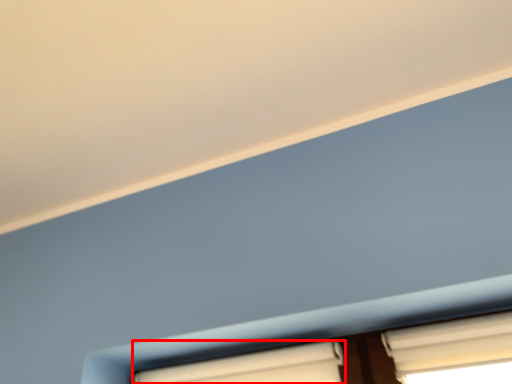
Question: From the image's perspective, where is window (annotated by the red box) located in relation to window in the image?

Choices:
 (A) above
 (B) below

Answer: (B)